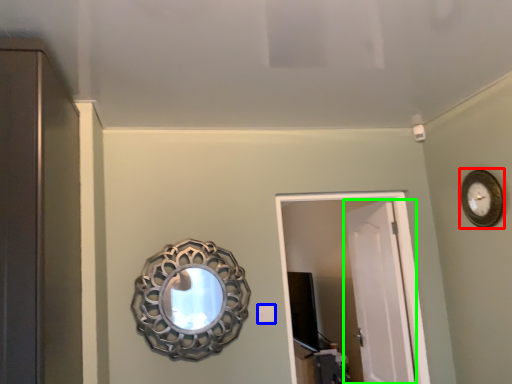
Question: Considering the real-world distances, which object is farthest from clock (highlighted by a red box)? light switch (highlighted by a blue box) or door (highlighted by a green box)?

Choices:
 (A) light switch
 (B) door

Answer: (A)